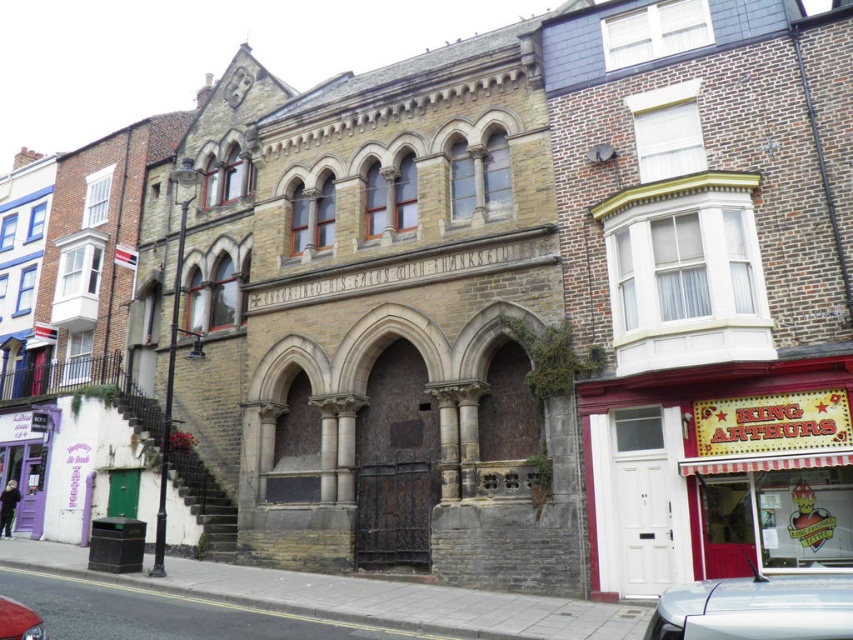
Question: Is silver metallic car at lower right thinner than shiny red car at lower left?

Choices:
 (A) yes
 (B) no

Answer: (B)

Question: Which point is farther to the camera?

Choices:
 (A) silver metallic car at lower right
 (B) red striped awning at lower right
 (C) shiny red car at lower left

Answer: (B)

Question: Is red striped awning at lower right to the left of shiny red car at lower left from the viewer's perspective?

Choices:
 (A) yes
 (B) no

Answer: (B)

Question: Which point is closer to the camera taking this photo?

Choices:
 (A) (18, 627)
 (B) (799, 621)
 (C) (724, 538)

Answer: (B)

Question: Which of the following is the closest to the observer?

Choices:
 (A) (22, 634)
 (B) (611, 545)

Answer: (A)

Question: Does red striped awning at lower right appear over silver metallic car at lower right?

Choices:
 (A) yes
 (B) no

Answer: (A)